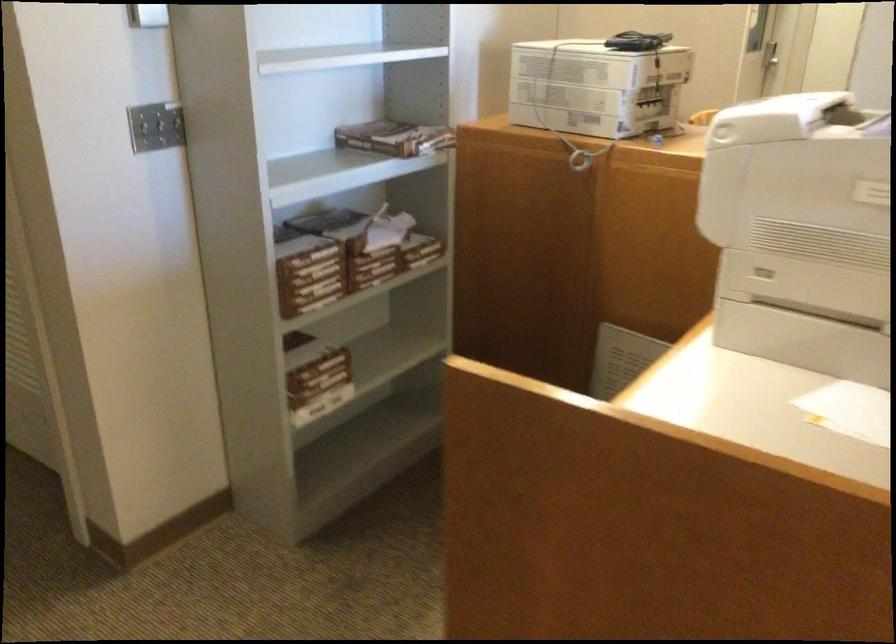
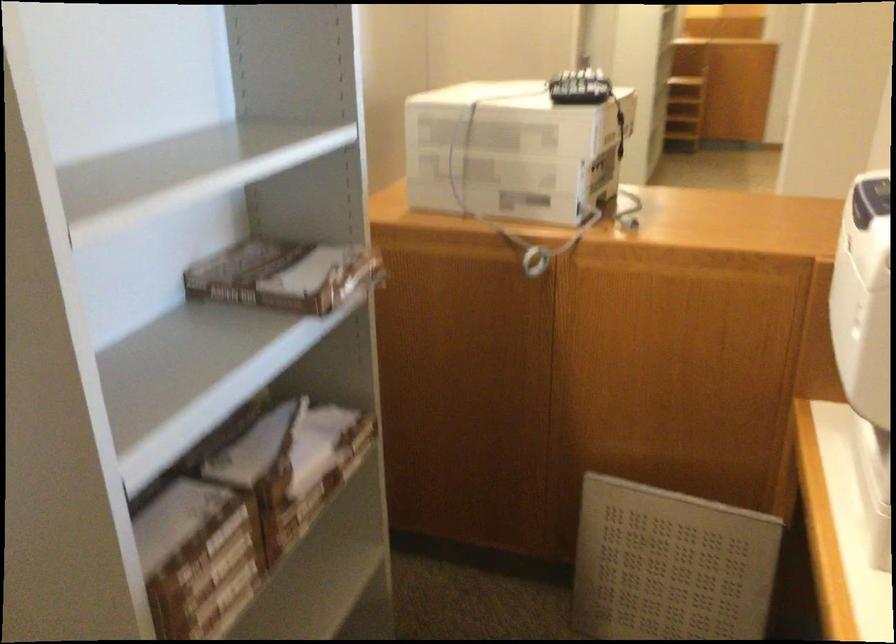
In the second image, find the point that corresponds to pixel 309 260 in the first image.

(209, 556)